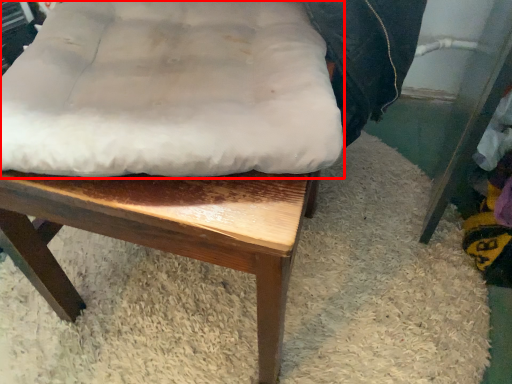
Question: In this image, where is sheet (annotated by the red box) located relative to chair?

Choices:
 (A) right
 (B) left

Answer: (B)